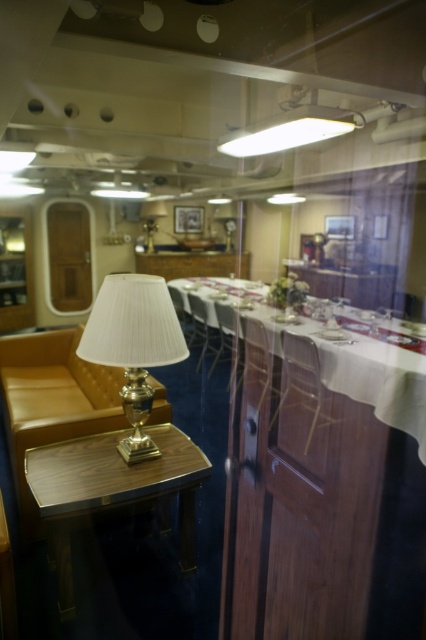
You are standing outside the ship dining area looking through the glass door. You see two points marked in the scene. Which point is closer to you, point [270,138] or point [207,333]?

Point [270,138] is in front of point [207,333], so it is closer to you.

You are a guest on a ship and want to find a place to sit. You see the white matte fluorescent light at upper center and the matte wood chair at center. Which object is closer to the ceiling?

The white matte fluorescent light at upper center is shorter than the matte wood chair at center, so the matte wood chair at center is closer to the ceiling.

You are standing outside the ship dining area looking through the glass door. You see the woodenwoodentable at lower left and the white cloth at center. Which object is closer to you?

The woodenwoodentable at lower left is closer to the viewer than the white cloth at center.